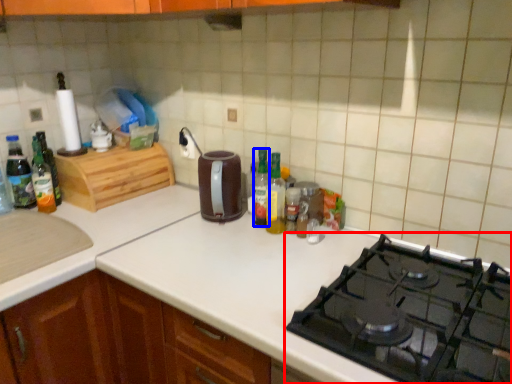
Question: Which object is further to the camera taking this photo, gas stove (highlighted by a red box) or bottle (highlighted by a blue box)?

Choices:
 (A) gas stove
 (B) bottle

Answer: (B)